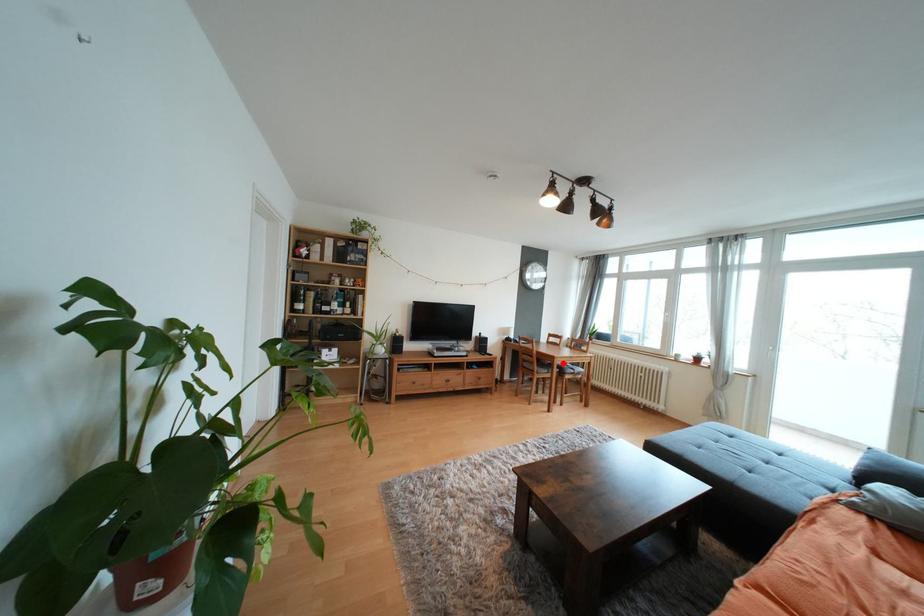
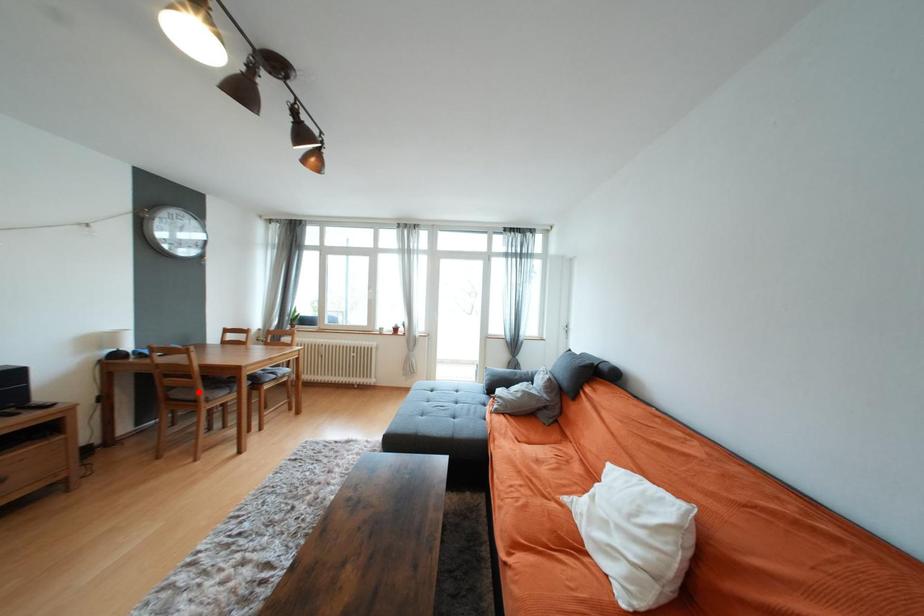
I am providing you with two images of the same scene from different viewpoints. A red point is marked on the first image and another point is marked on the second image. Does the point marked in image1 correspond to the same location as the one in image2?

No